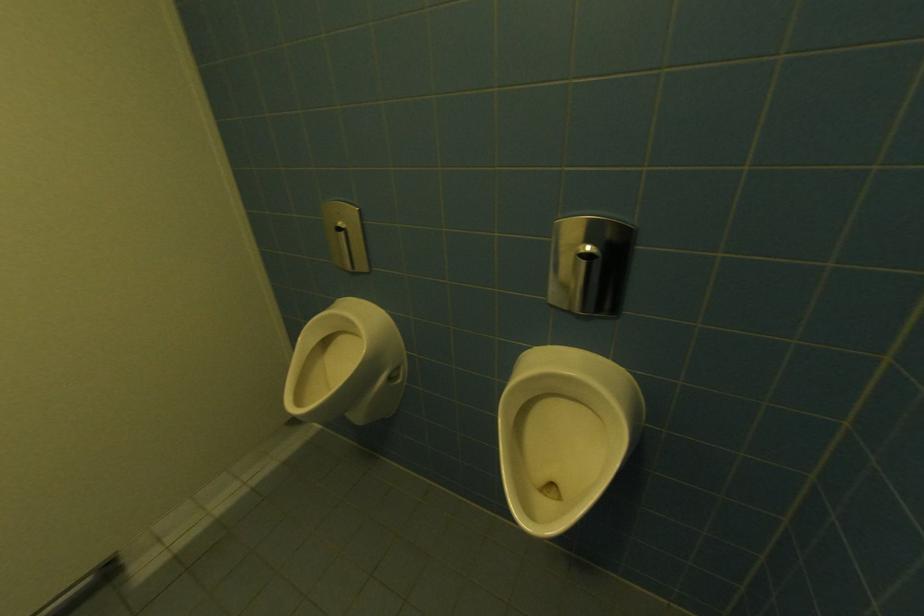
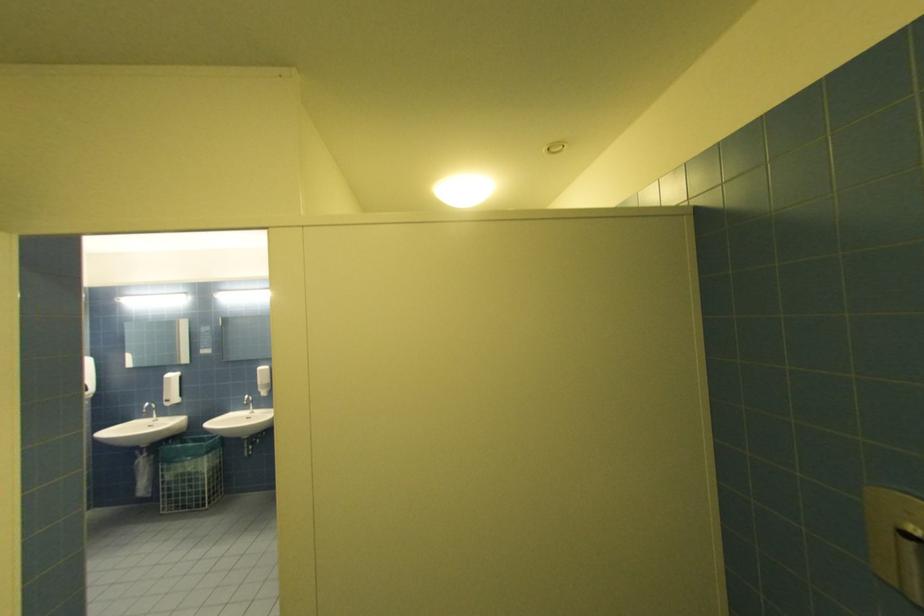
First-person continuous shooting, in which direction is the camera rotating?

The camera's rotation is toward left-up.